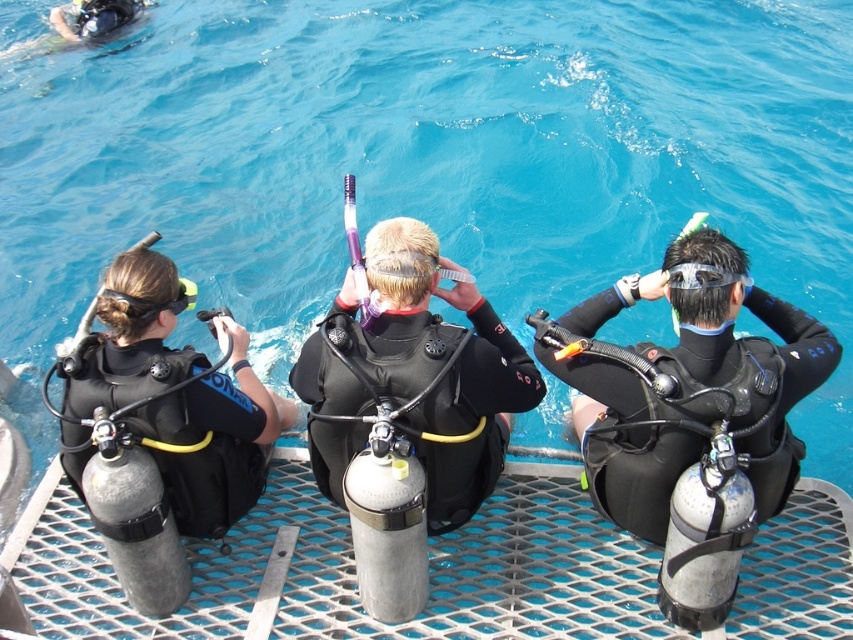
You are a scuba diving instructor assessing the equipment of two divers on the platform. You notice the black matte wetsuit at right and the black matte wetsuit at center. Which wetsuit has a larger width according to the description?

The black matte wetsuit at right might be wider than black matte wetsuit at center.

You are a lifeguard assessing the safety of the diving platform. You notice two black matte wetsuit at right and black matte wetsuit at left. Which wetsuit is more likely to block the view of the diver behind them when they turn sideways?

The black matte wetsuit at right might be wider than black matte wetsuit at left, so it could block the view more when turning sideways.

You are a scuba diving instructor observing the three divers on the metal grid platform. You need to ensure that the oxygen tanks are properly secured. Since the black matte wetsuit at center and the black matte wetsuit at left are both wearing oxygen tanks, which diver should you check first based on their position?

The black matte wetsuit at center has a greater height compared to the black matte wetsuit at left, so you should check the oxygen tank of the black matte wetsuit at center first because it is taller and might require more attention to ensure stability.